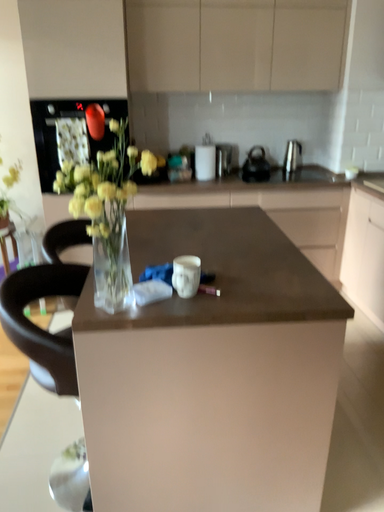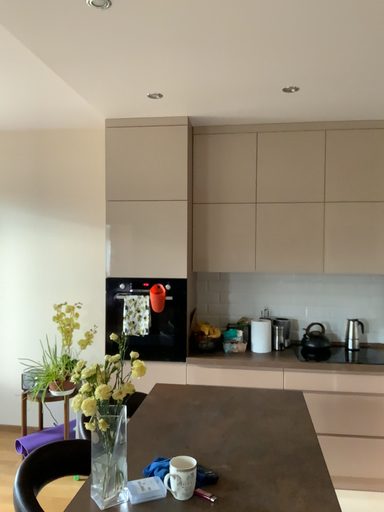
Question: How did the camera likely rotate when shooting the video?

Choices:
 (A) rotated left
 (B) rotated right

Answer: (A)